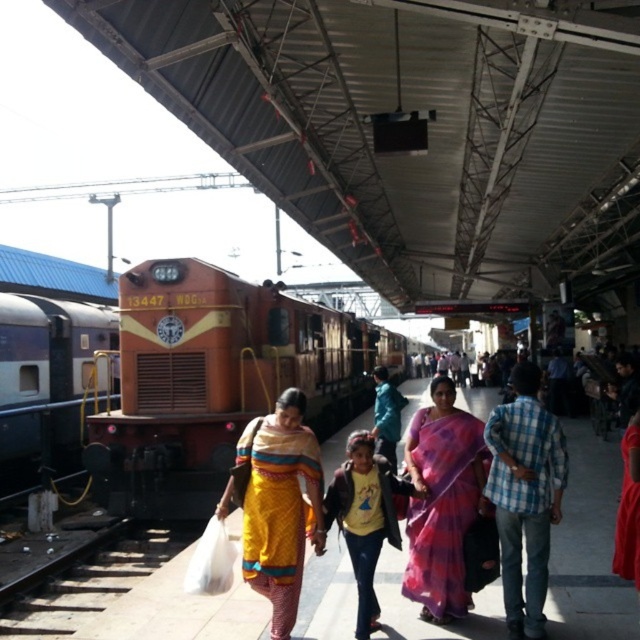
Consider the image. Is matte orange train at left positioned in front of pink silk saree at center?

No, matte orange train at left is further to the viewer.

Who is shorter, matte orange train at left or pink silk saree at center?

With less height is pink silk saree at center.

Image resolution: width=640 pixels, height=640 pixels. What are the coordinates of `matte orange train at left` in the screenshot? It's located at (52, 349).

This screenshot has width=640, height=640. Identify the location of matte orange train at left. (52, 349).

Is yellow silk saree at center bigger than yellow cotton shirt at center?

Correct, yellow silk saree at center is larger in size than yellow cotton shirt at center.

From the picture: Does yellow silk saree at center appear on the left side of yellow cotton shirt at center?

In fact, yellow silk saree at center is to the right of yellow cotton shirt at center.

Is point (600, 525) closer to camera compared to point (330, 516)?

That is False.

Where is `yellow silk saree at center`? The image size is (640, 640). yellow silk saree at center is located at coordinates (588, 545).

Between point (268, 522) and point (365, 508), which one is positioned behind?

Point (365, 508)

Identify the location of yellow printed sari at center. (280, 506).